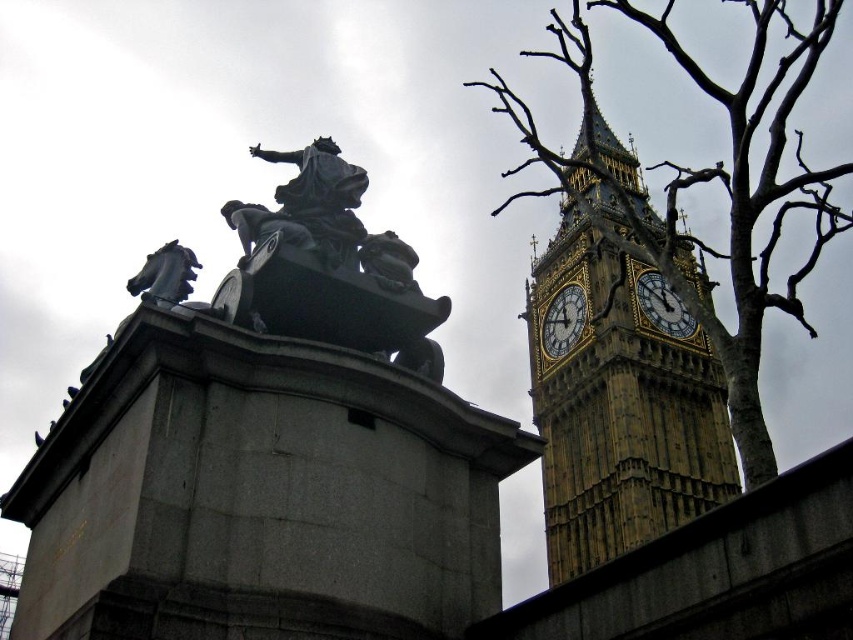
You are standing at a viewpoint where you can see both the statue and the Elizabeth Tower. A tour guide mentions that there is a specific point marked at coordinates point [230,227] that is exactly 50.07 meters away from you. If you want to take a photo that includes both landmarks, would this point be in the foreground or background of your shot?

The point marked at coordinates point [230,227] is 50.07 meters away from the viewer. Since it is relatively far away, this point would be in the background of the photo.

Based on the photo, what does the point at coordinates (306,204) indicate in the image?

The point at coordinates (306,204) marks the bronze statue at center.